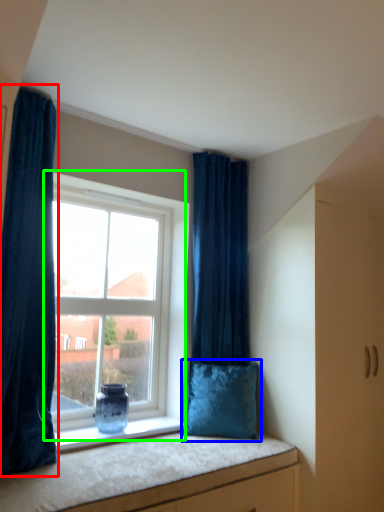
Question: Which object is the closest to the curtain (highlighted by a red box)? Choose among these: pillow (highlighted by a blue box) or window (highlighted by a green box).

Choices:
 (A) pillow
 (B) window

Answer: (B)